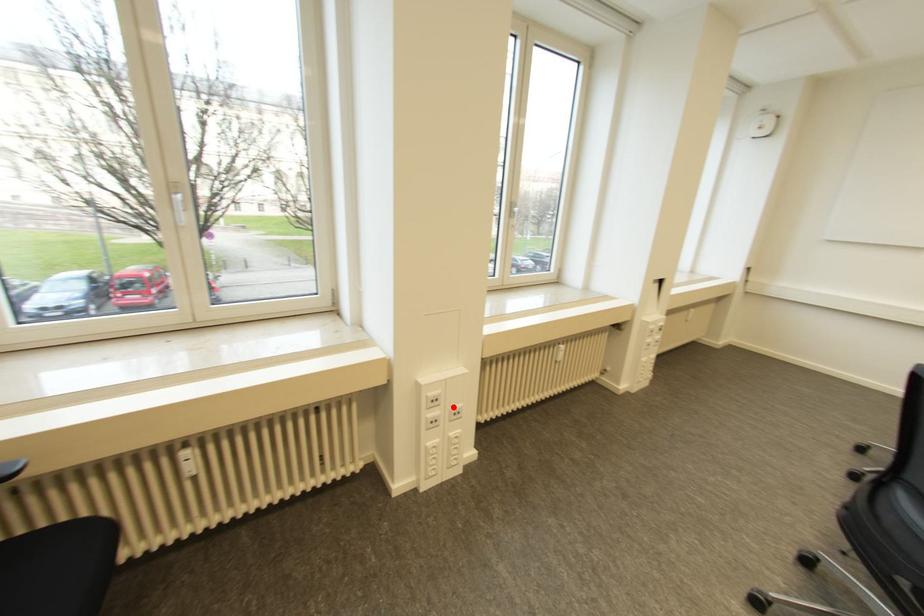
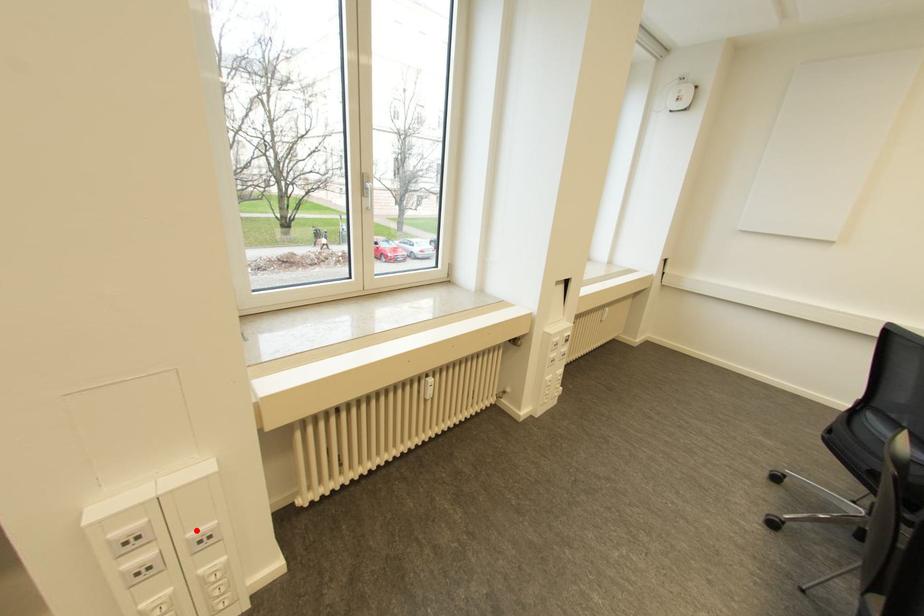
I am providing you with two images of the same scene from different viewpoints. A red point is marked on the first image and another point is marked on the second image. Do the highlighted points in image1 and image2 indicate the same real-world spot?

Yes